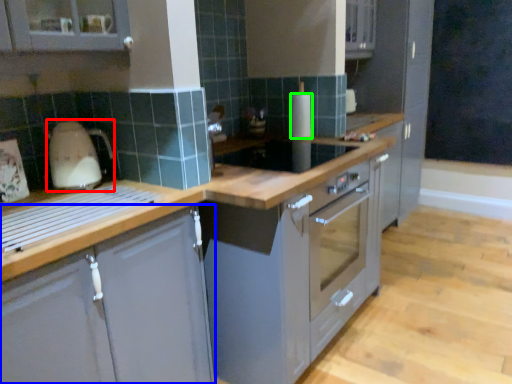
Question: Estimate the real-world distances between objects in this image. Which object is farther from home appliance (highlighted by a red box), cabinetry (highlighted by a blue box) or kitchen appliance (highlighted by a green box)?

Choices:
 (A) cabinetry
 (B) kitchen appliance

Answer: (B)